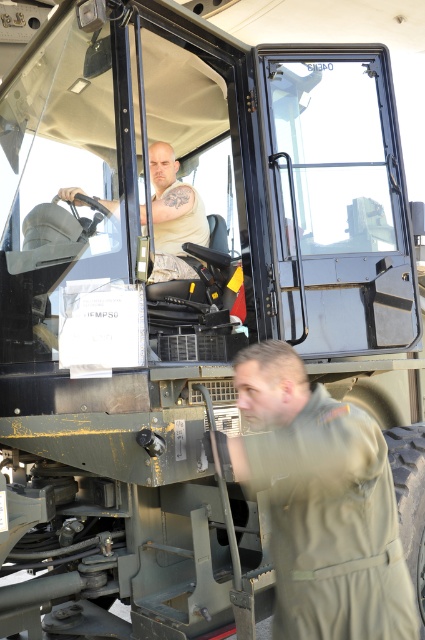
Between olive green uniform at lower right and matte khaki uniform at center, which one is positioned lower?

Positioned lower is olive green uniform at lower right.

Where is `olive green uniform at lower right`? Image resolution: width=425 pixels, height=640 pixels. olive green uniform at lower right is located at coordinates (320, 502).